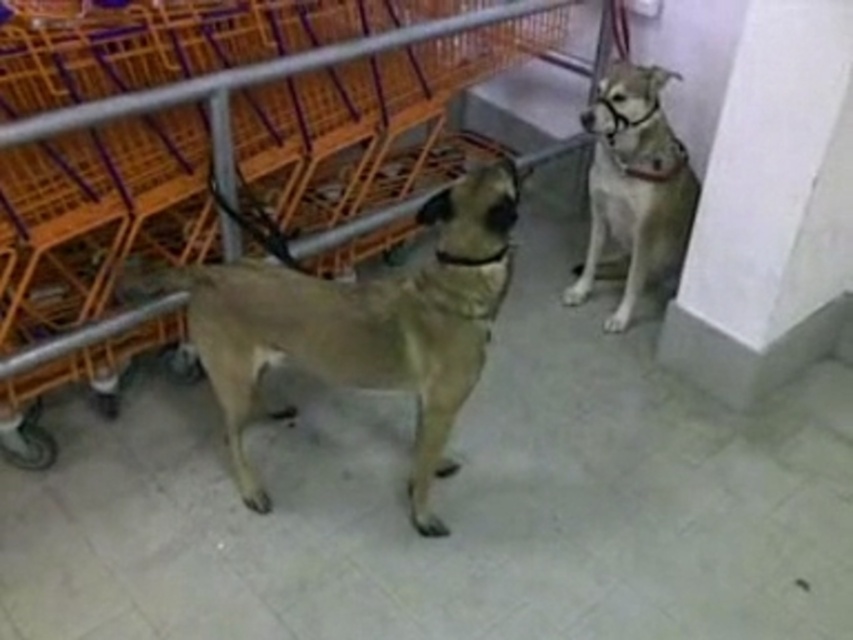
You are a customer in a pet store and see the orange plastic cart at left and the light brown fur at upper right. Which object is closer to you?

A: The orange plastic cart at left is closer to you because it is positioned over the light brown fur at upper right, indicating it is in front of it.

Looking at this image, you are a customer in a pet store and want to find the light brown fur at center. Which direction should you look relative to the orange plastic cart at left?

The orange plastic cart at left is positioned on the left side of light brown fur at center, so you should look to the right of the orange plastic cart at left to find the light brown fur at center.